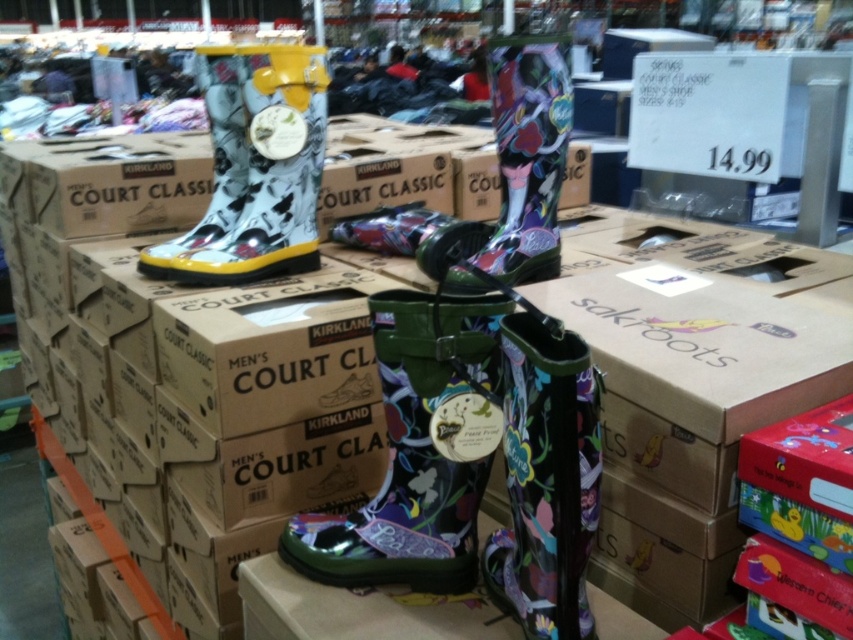
Which is in front, point (384, 380) or point (222, 150)?

Point (384, 380)

What do you see at coordinates (419, 449) in the screenshot? I see `green glossy rain boot at center` at bounding box center [419, 449].

Locate an element on the screen. green glossy rain boot at center is located at coordinates (419, 449).

Does green glossy rain boot at center lie in front of floral-patterned rubber boot at center?

That is False.

Which is in front, point (370, 321) or point (572, 525)?

Point (572, 525) is more forward.

Is point (372, 513) closer to viewer compared to point (535, 451)?

No, (372, 513) is behind (535, 451).

Locate an element on the screen. The image size is (853, 640). green glossy rain boot at center is located at coordinates (419, 449).

Does shiny floral-patterned boot at center appear under matte rubber boot at upper left?

Correct, shiny floral-patterned boot at center is located below matte rubber boot at upper left.

Can you confirm if shiny floral-patterned boot at center is bigger than matte rubber boot at upper left?

No.

Who is more forward, (495, 237) or (138, 268)?

Point (495, 237) is more forward.

This screenshot has height=640, width=853. In order to click on shiny floral-patterned boot at center in this screenshot , I will do `click(527, 154)`.